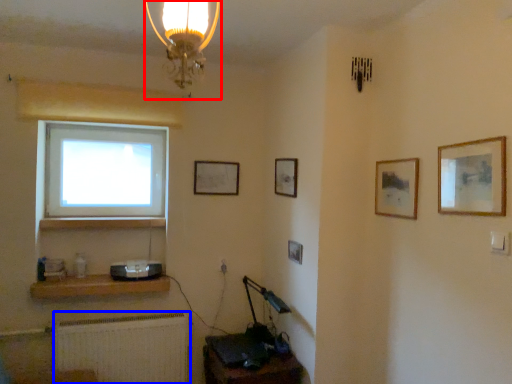
Question: Which point is further to the camera, lamp (highlighted by a red box) or radiator (highlighted by a blue box)?

Choices:
 (A) lamp
 (B) radiator

Answer: (B)